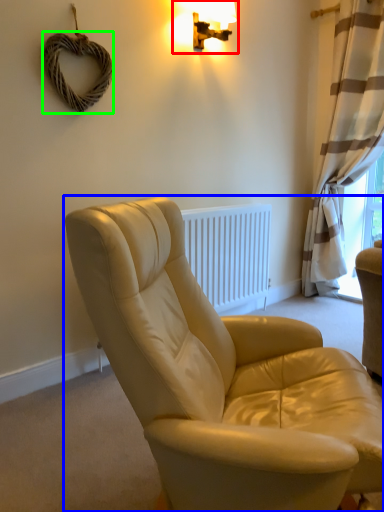
Question: Which is farther away from lamp (highlighted by a red box)? studio couch (highlighted by a blue box) or rope (highlighted by a green box)?

Choices:
 (A) studio couch
 (B) rope

Answer: (A)